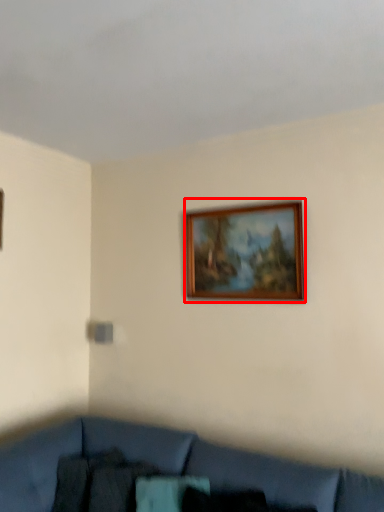
Question: Where is picture frame (annotated by the red box) located in relation to studio couch in the image?

Choices:
 (A) right
 (B) left

Answer: (A)